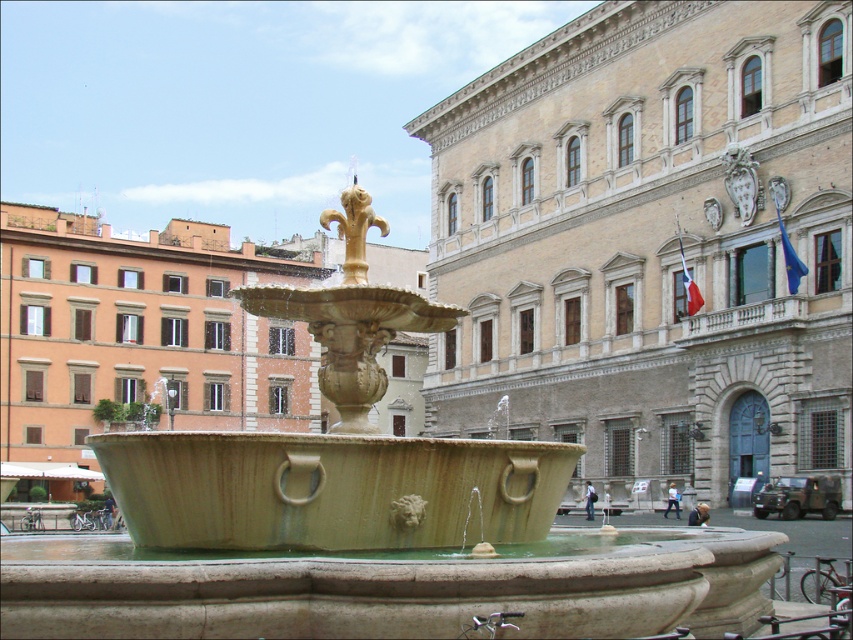
You are standing at the center of the square facing the fountain. There are two points marked in the image. The first point is at coordinates point (323, 330) and the second is at point (329, 220). Which point is closer to you?

Point (323, 330) is in front of point (329, 220), so it is closer to you.